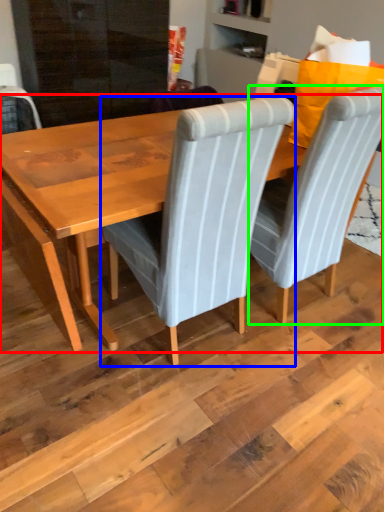
Question: Which object is the farthest from table (highlighted by a red box)? Choose among these: chair (highlighted by a blue box) or chair (highlighted by a green box).

Choices:
 (A) chair
 (B) chair

Answer: (B)